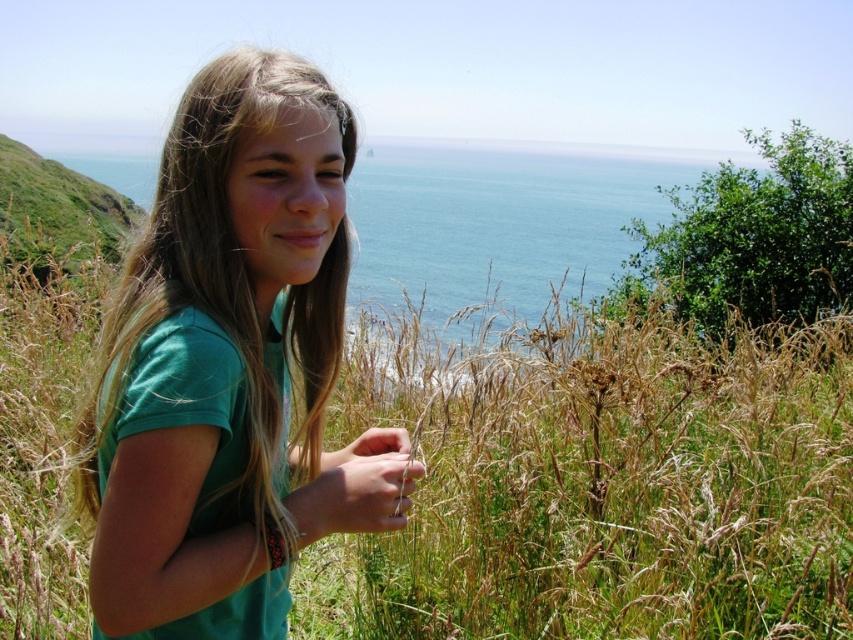
Is dry grass at center further to the viewer compared to blue water at upper center?

Yes, it is.

Does dry grass at center come in front of blue water at upper center?

That is False.

Identify the location of dry grass at center. tap(599, 483).

Find the location of a particular element. This screenshot has width=853, height=640. green matte shirt at center is located at coordinates (228, 365).

Is green matte shirt at center positioned before green leafy plant at upper right?

Yes, it is.

Locate an element on the screen. green matte shirt at center is located at coordinates (228, 365).

Does dry grass at center have a greater height compared to green leafy plant at upper right?

No, dry grass at center is not taller than green leafy plant at upper right.

Does dry grass at center have a larger size compared to green leafy plant at upper right?

Actually, dry grass at center might be smaller than green leafy plant at upper right.

The image size is (853, 640). Describe the element at coordinates (599, 483) in the screenshot. I see `dry grass at center` at that location.

Where is `dry grass at center`? Image resolution: width=853 pixels, height=640 pixels. dry grass at center is located at coordinates (599, 483).